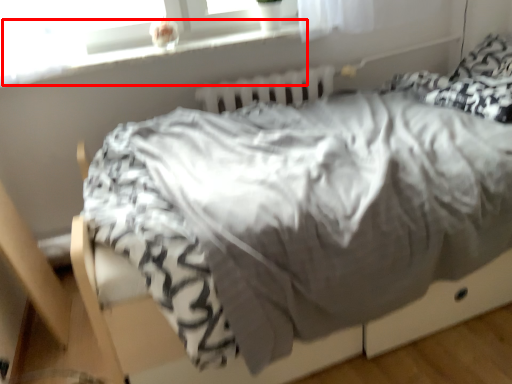
Question: From the image, what is the correct spatial relationship of window sill (annotated by the red box) in relation to radiator?

Choices:
 (A) left
 (B) right

Answer: (A)